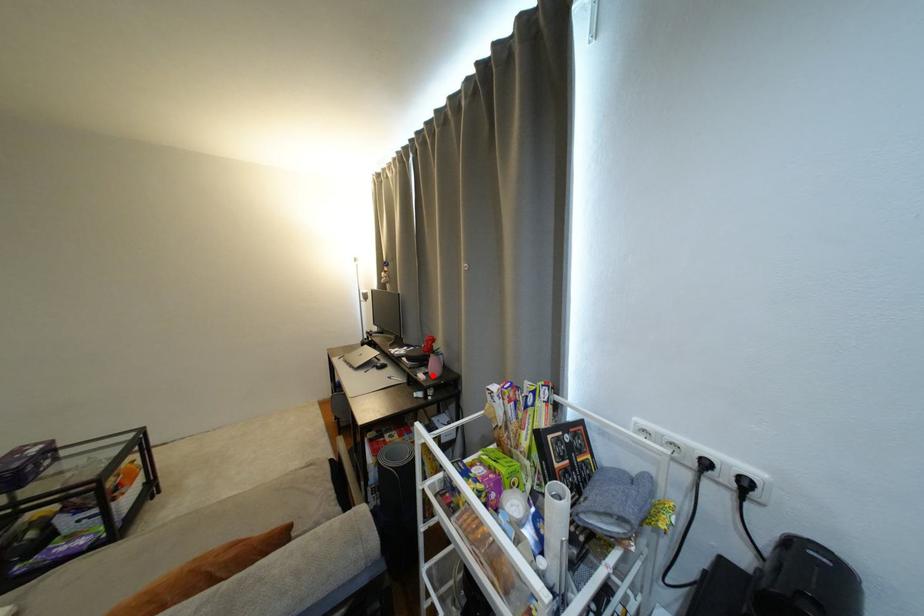
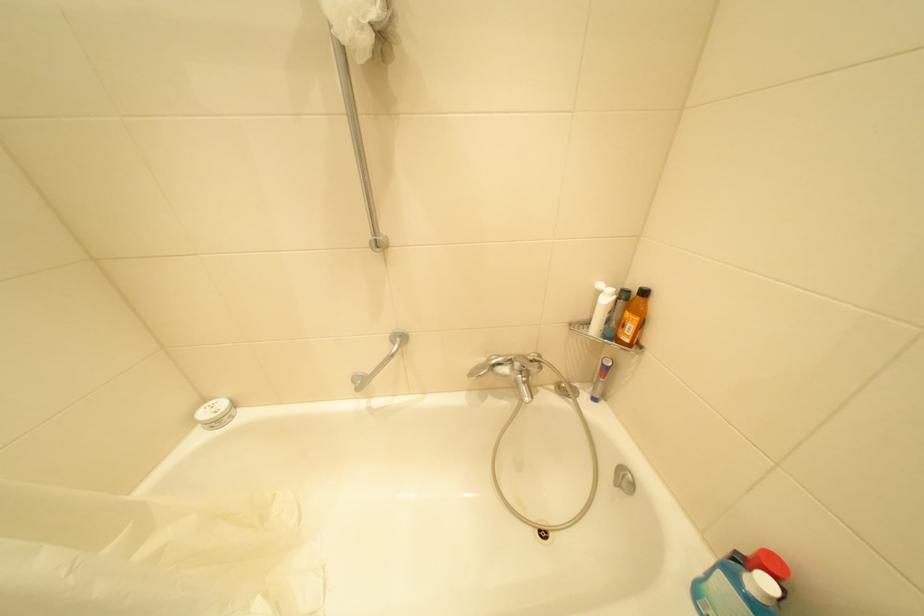
Question: I am providing you with two images of the same scene from different viewpoints. A red point is marked on the first image. Is the red point's position out of view in image 2?

Choices:
 (A) Yes
 (B) No

Answer: (A)